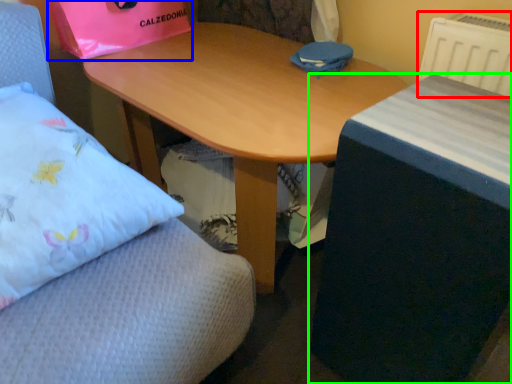
Question: Which is nearer to the radiator (highlighted by a red box)? paper bag (highlighted by a blue box) or table (highlighted by a green box).

Choices:
 (A) paper bag
 (B) table

Answer: (B)